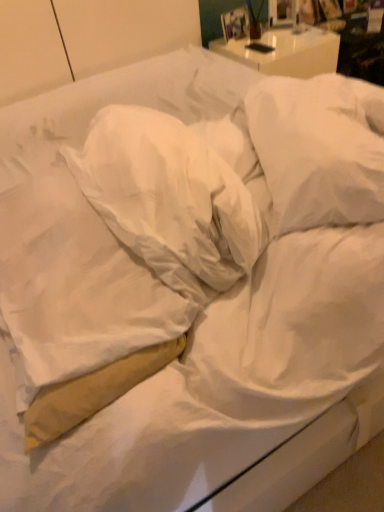
The width and height of the screenshot is (384, 512). I want to click on white soft pillow at center, which appears as the second pillow when viewed from the left, so click(x=173, y=197).

From a real-world perspective, is white soft pillow at center, which appears as the second pillow when viewed from the left, positioned above or below tan fabric pillow at left, which ranks as the 1th pillow in left-to-right order?

In terms of real-world spatial position, white soft pillow at center, which appears as the second pillow when viewed from the left, is above tan fabric pillow at left, which ranks as the 1th pillow in left-to-right order.

Considering the sizes of objects white soft pillow at center, the 2th pillow when ordered from right to left, and tan fabric pillow at left, placed as the 3th pillow when sorted from right to left, in the image provided, who is thinner, white soft pillow at center, the 2th pillow when ordered from right to left, or tan fabric pillow at left, placed as the 3th pillow when sorted from right to left,?

With smaller width is white soft pillow at center, the 2th pillow when ordered from right to left.

Could you tell me if white soft pillow at center, which appears as the second pillow when viewed from the left, is turned towards tan fabric pillow at left, placed as the 3th pillow when sorted from right to left?

No, white soft pillow at center, which appears as the second pillow when viewed from the left, is not facing towards tan fabric pillow at left, placed as the 3th pillow when sorted from right to left.

In terms of height, does tan fabric pillow at left, placed as the 3th pillow when sorted from right to left, look taller or shorter compared to white soft pillow at center, which appears as the second pillow when viewed from the left?

Clearly, tan fabric pillow at left, placed as the 3th pillow when sorted from right to left, is shorter compared to white soft pillow at center, which appears as the second pillow when viewed from the left.

Looking at this image, considering the relative positions of tan fabric pillow at left, which ranks as the 1th pillow in left-to-right order, and white soft pillow at center, which appears as the second pillow when viewed from the left, in the image provided, is tan fabric pillow at left, which ranks as the 1th pillow in left-to-right order, in front of white soft pillow at center, which appears as the second pillow when viewed from the left,?

Yes, it is.

Considering the positions of objects tan fabric pillow at left, placed as the 3th pillow when sorted from right to left, and white soft pillow at center, the 2th pillow when ordered from right to left, in the image provided, who is more to the right, tan fabric pillow at left, placed as the 3th pillow when sorted from right to left, or white soft pillow at center, the 2th pillow when ordered from right to left,?

Positioned to the right is white soft pillow at center, the 2th pillow when ordered from right to left.

Is tan fabric pillow at left, which ranks as the 1th pillow in left-to-right order, at the left side of white soft pillow at upper right, which is the third pillow from left to right?

Yes.

Is tan fabric pillow at left, which ranks as the 1th pillow in left-to-right order, touching white soft pillow at upper right, which is the third pillow from left to right?

tan fabric pillow at left, which ranks as the 1th pillow in left-to-right order, and white soft pillow at upper right, which is the third pillow from left to right, are not in contact.

Can you tell me how much tan fabric pillow at left, placed as the 3th pillow when sorted from right to left, and white soft pillow at upper right, which is the third pillow from left to right, differ in facing direction?

They differ by 21.4 degrees in their facing directions.

From a real-world perspective, who is located higher, tan fabric pillow at left, placed as the 3th pillow when sorted from right to left, or white soft pillow at upper right, which is the third pillow from left to right?

white soft pillow at upper right, which is the third pillow from left to right.

In the image, is white soft pillow at upper right, which appears as the 1th pillow when viewed from the right, on the left side or the right side of tan fabric pillow at left, which ranks as the 1th pillow in left-to-right order?

white soft pillow at upper right, which appears as the 1th pillow when viewed from the right, is to the right of tan fabric pillow at left, which ranks as the 1th pillow in left-to-right order.

Considering the relative sizes of white soft pillow at upper right, which is the third pillow from left to right, and tan fabric pillow at left, placed as the 3th pillow when sorted from right to left, in the image provided, is white soft pillow at upper right, which is the third pillow from left to right, shorter than tan fabric pillow at left, placed as the 3th pillow when sorted from right to left,?

Indeed, white soft pillow at upper right, which is the third pillow from left to right, has a lesser height compared to tan fabric pillow at left, placed as the 3th pillow when sorted from right to left.

Which pillow is the 2nd one when counting from the back of the tan fabric pillow at left, placed as the 3th pillow when sorted from right to left? Please provide its 2D coordinates.

[(319, 149)]

Considering the points (362, 173) and (159, 308), which point is in front, point (362, 173) or point (159, 308)?

The point (159, 308) is more forward.

Relative to white soft pillow at center, the 2th pillow when ordered from right to left, is white soft pillow at upper right, which is the third pillow from left to right, in front or behind?

white soft pillow at upper right, which is the third pillow from left to right, is positioned farther from the viewer than white soft pillow at center, the 2th pillow when ordered from right to left.

This screenshot has width=384, height=512. Find the location of `the 1st pillow positioned below the white soft pillow at center, the 2th pillow when ordered from right to left (from a real-world perspective)`. the 1st pillow positioned below the white soft pillow at center, the 2th pillow when ordered from right to left (from a real-world perspective) is located at coordinates (319, 149).

Is point (369, 191) positioned behind point (173, 225)?

Yes.

Could you tell me if white soft pillow at upper right, which appears as the 1th pillow when viewed from the right, is turned towards white soft pillow at center, the 2th pillow when ordered from right to left?

No, white soft pillow at upper right, which appears as the 1th pillow when viewed from the right, is not turned towards white soft pillow at center, the 2th pillow when ordered from right to left.

Between white soft pillow at center, which appears as the second pillow when viewed from the left, and white soft pillow at upper right, which is the third pillow from left to right, which one appears on the right side from the viewer's perspective?

Positioned to the right is white soft pillow at upper right, which is the third pillow from left to right.

Is white soft pillow at center, the 2th pillow when ordered from right to left, next to white soft pillow at upper right, which appears as the 1th pillow when viewed from the right, and touching it?

No, white soft pillow at center, the 2th pillow when ordered from right to left, is not in contact with white soft pillow at upper right, which appears as the 1th pillow when viewed from the right.

From a real-world perspective, between white soft pillow at center, which appears as the second pillow when viewed from the left, and white soft pillow at upper right, which is the third pillow from left to right, who is vertically higher?

From a 3D spatial view, white soft pillow at center, which appears as the second pillow when viewed from the left, is above.

Between white soft pillow at center, which appears as the second pillow when viewed from the left, and white soft pillow at upper right, which appears as the 1th pillow when viewed from the right, which one has larger width?

white soft pillow at upper right, which appears as the 1th pillow when viewed from the right, is wider.

Where is `pillow below the white soft pillow at center, the 2th pillow when ordered from right to left (from the image's perspective)`? This screenshot has height=512, width=384. pillow below the white soft pillow at center, the 2th pillow when ordered from right to left (from the image's perspective) is located at coordinates (70, 278).

The width and height of the screenshot is (384, 512). I want to click on pillow on the left of white soft pillow at center, which appears as the second pillow when viewed from the left, so click(x=70, y=278).

Estimate the real-world distances between objects in this image. Which object is further from tan fabric pillow at left, placed as the 3th pillow when sorted from right to left, white soft pillow at center, which appears as the second pillow when viewed from the left, or white soft pillow at upper right, which appears as the 1th pillow when viewed from the right?

The object further to tan fabric pillow at left, placed as the 3th pillow when sorted from right to left, is white soft pillow at upper right, which appears as the 1th pillow when viewed from the right.

Which object lies nearer to the anchor point white soft pillow at center, the 2th pillow when ordered from right to left, white soft pillow at upper right, which is the third pillow from left to right, or tan fabric pillow at left, placed as the 3th pillow when sorted from right to left?

Based on the image, tan fabric pillow at left, placed as the 3th pillow when sorted from right to left, appears to be nearer to white soft pillow at center, the 2th pillow when ordered from right to left.

Based on their spatial positions, is tan fabric pillow at left, placed as the 3th pillow when sorted from right to left, or white soft pillow at center, the 2th pillow when ordered from right to left, further from white soft pillow at upper right, which is the third pillow from left to right?

tan fabric pillow at left, placed as the 3th pillow when sorted from right to left, is positioned further to the anchor white soft pillow at upper right, which is the third pillow from left to right.

Looking at the image, which one is located further to tan fabric pillow at left, which ranks as the 1th pillow in left-to-right order, white soft pillow at upper right, which appears as the 1th pillow when viewed from the right, or white soft pillow at center, the 2th pillow when ordered from right to left?

white soft pillow at upper right, which appears as the 1th pillow when viewed from the right.

When comparing their distances from white soft pillow at upper right, which appears as the 1th pillow when viewed from the right, does white soft pillow at center, the 2th pillow when ordered from right to left, or tan fabric pillow at left, which ranks as the 1th pillow in left-to-right order, seem further?

tan fabric pillow at left, which ranks as the 1th pillow in left-to-right order, is further to white soft pillow at upper right, which appears as the 1th pillow when viewed from the right.

Estimate the real-world distances between objects in this image. Which object is further from white soft pillow at center, the 2th pillow when ordered from right to left, tan fabric pillow at left, which ranks as the 1th pillow in left-to-right order, or white soft pillow at upper right, which is the third pillow from left to right?

The object further to white soft pillow at center, the 2th pillow when ordered from right to left, is white soft pillow at upper right, which is the third pillow from left to right.

In order to click on pillow situated between tan fabric pillow at left, placed as the 3th pillow when sorted from right to left, and white soft pillow at upper right, which is the third pillow from left to right, from left to right in this screenshot , I will do `click(173, 197)`.